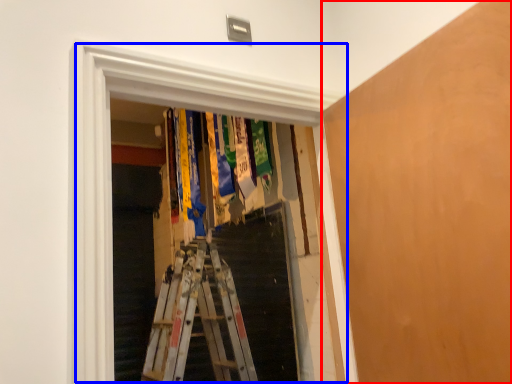
Question: Among these objects, which one is nearest to the camera, plywood (highlighted by a red box) or window (highlighted by a blue box)?

Choices:
 (A) plywood
 (B) window

Answer: (A)